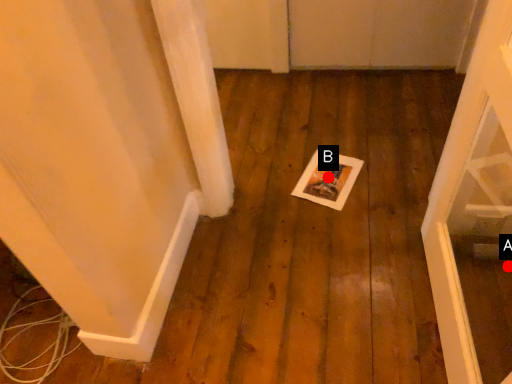
Question: Two points are circled on the image, labeled by A and B beside each circle. Which point is closer to the camera taking this photo?

Choices:
 (A) A is closer
 (B) B is closer

Answer: (A)